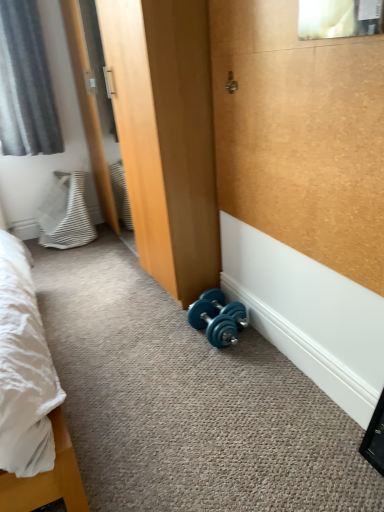
Measure the distance between point (12,78) and camera.

Point (12,78) and camera are 2.59 meters apart from each other.

Where is `white striped fabric pillow at left`? The width and height of the screenshot is (384, 512). white striped fabric pillow at left is located at coordinates pos(64,212).

The image size is (384, 512). Describe the element at coordinates (218, 318) in the screenshot. I see `teal rubber dumbbell at lower center` at that location.

Where is `clear glass mirror at upper center`? The image size is (384, 512). clear glass mirror at upper center is located at coordinates (338, 18).

Can you tell me how much white striped fabric pillow at left and clear glass mirror at upper center differ in facing direction?

95.2 degrees separate the facing orientations of white striped fabric pillow at left and clear glass mirror at upper center.

From a real-world perspective, which is physically above, white striped fabric pillow at left or clear glass mirror at upper center?

clear glass mirror at upper center.

Is white striped fabric pillow at left bigger than clear glass mirror at upper center?

Yes.

In terms of height, does white striped fabric pillow at left look taller or shorter compared to clear glass mirror at upper center?

Considering their sizes, white striped fabric pillow at left has more height than clear glass mirror at upper center.

Between teal rubber dumbbell at lower center and clear glass mirror at upper center, which one appears on the left side from the viewer's perspective?

teal rubber dumbbell at lower center.

In terms of size, does teal rubber dumbbell at lower center appear bigger or smaller than clear glass mirror at upper center?

Considering their sizes, teal rubber dumbbell at lower center takes up more space than clear glass mirror at upper center.

Is teal rubber dumbbell at lower center thinner than clear glass mirror at upper center?

Incorrect, the width of teal rubber dumbbell at lower center is not less than that of clear glass mirror at upper center.

From the image's perspective, which one is positioned higher, teal rubber dumbbell at lower center or clear glass mirror at upper center?

clear glass mirror at upper center, from the image's perspective.

Is gray fabric curtain at upper left oriented away from clear glass mirror at upper center?

No.

Identify the location of curtain that is under the clear glass mirror at upper center (from a real-world perspective). Image resolution: width=384 pixels, height=512 pixels. (25, 84).

Considering the relative positions of gray fabric curtain at upper left and clear glass mirror at upper center in the image provided, is gray fabric curtain at upper left to the left or to the right of clear glass mirror at upper center?

gray fabric curtain at upper left is to the left of clear glass mirror at upper center.

Based on their positions, is teal rubber dumbbell at lower center located to the left or right of white striped fabric pillow at left?

teal rubber dumbbell at lower center is to the right of white striped fabric pillow at left.

Are teal rubber dumbbell at lower center and white striped fabric pillow at left far apart?

Yes, teal rubber dumbbell at lower center and white striped fabric pillow at left are located far from each other.

Can you tell me how much teal rubber dumbbell at lower center and white striped fabric pillow at left differ in facing direction?

The angular difference between teal rubber dumbbell at lower center and white striped fabric pillow at left is 89.2 degrees.

Is white striped fabric pillow at left inside teal rubber dumbbell at lower center?

No.

Which is more distant, (81, 232) or (217, 298)?

The point (81, 232) is farther.

Is white striped fabric pillow at left aimed at teal rubber dumbbell at lower center?

Yes, white striped fabric pillow at left is oriented towards teal rubber dumbbell at lower center.

Consider the image. Would you say teal rubber dumbbell at lower center is part of white striped fabric pillow at left's contents?

No, teal rubber dumbbell at lower center is not surrounded by white striped fabric pillow at left.

Image resolution: width=384 pixels, height=512 pixels. In order to click on pillow behind the teal rubber dumbbell at lower center in this screenshot , I will do `click(64, 212)`.

Based on the photo, from the image's perspective, between gray fabric curtain at upper left and white striped fabric pillow at left, which one is located above?

From the image's view, gray fabric curtain at upper left is above.

Can you tell me how much gray fabric curtain at upper left and white striped fabric pillow at left differ in facing direction?

4.37 degrees.

From a real-world perspective, is gray fabric curtain at upper left above or below white striped fabric pillow at left?

In terms of real-world spatial position, gray fabric curtain at upper left is above white striped fabric pillow at left.

Can you confirm if gray fabric curtain at upper left is positioned to the right of white striped fabric pillow at left?

In fact, gray fabric curtain at upper left is to the left of white striped fabric pillow at left.

Is clear glass mirror at upper center to the left of white striped fabric pillow at left from the viewer's perspective?

Incorrect, clear glass mirror at upper center is not on the left side of white striped fabric pillow at left.

Is point (372, 13) positioned before point (51, 203)?

That is True.

Who is taller, clear glass mirror at upper center or white striped fabric pillow at left?

white striped fabric pillow at left is taller.

Find the location of a particular element. window screen above the white striped fabric pillow at left (from the image's perspective) is located at coordinates (338, 18).

Find the location of a particular element. The width and height of the screenshot is (384, 512). pillow that appears on the left of clear glass mirror at upper center is located at coordinates (64, 212).

The height and width of the screenshot is (512, 384). I want to click on dumbbell beneath the clear glass mirror at upper center (from a real-world perspective), so click(x=218, y=318).

Which object lies further to the anchor point white striped fabric pillow at left, clear glass mirror at upper center or gray fabric curtain at upper left?

clear glass mirror at upper center is positioned further to the anchor white striped fabric pillow at left.

Estimate the real-world distances between objects in this image. Which object is closer to gray fabric curtain at upper left, teal rubber dumbbell at lower center or clear glass mirror at upper center?

Based on the image, teal rubber dumbbell at lower center appears to be nearer to gray fabric curtain at upper left.

From the image, which object appears to be nearer to white striped fabric pillow at left, teal rubber dumbbell at lower center or gray fabric curtain at upper left?

gray fabric curtain at upper left lies closer to white striped fabric pillow at left than the other object.

Based on the photo, looking at the image, which one is located further to white striped fabric pillow at left, gray fabric curtain at upper left or teal rubber dumbbell at lower center?

teal rubber dumbbell at lower center lies further to white striped fabric pillow at left than the other object.

From the image, which object appears to be nearer to gray fabric curtain at upper left, teal rubber dumbbell at lower center or white striped fabric pillow at left?

Based on the image, white striped fabric pillow at left appears to be nearer to gray fabric curtain at upper left.

From the image, which object appears to be farther from teal rubber dumbbell at lower center, gray fabric curtain at upper left or white striped fabric pillow at left?

Among the two, gray fabric curtain at upper left is located further to teal rubber dumbbell at lower center.

From the image, which object appears to be farther from clear glass mirror at upper center, white striped fabric pillow at left or teal rubber dumbbell at lower center?

Among the two, white striped fabric pillow at left is located further to clear glass mirror at upper center.

Which object lies further to the anchor point clear glass mirror at upper center, teal rubber dumbbell at lower center or white striped fabric pillow at left?

white striped fabric pillow at left is positioned further to the anchor clear glass mirror at upper center.

Where is `dumbbell between clear glass mirror at upper center and white striped fabric pillow at left from front to back`? The image size is (384, 512). dumbbell between clear glass mirror at upper center and white striped fabric pillow at left from front to back is located at coordinates (218, 318).

You are a GUI agent. You are given a task and a screenshot of the screen. Output one action in this format:
    pyautogui.click(x=<x>, y=<y>)
    Task: Click on the curtain between clear glass mirror at upper center and white striped fabric pillow at left in the front-back direction
    The image size is (384, 512).
    Given the screenshot: What is the action you would take?
    pyautogui.click(x=25, y=84)

The height and width of the screenshot is (512, 384). I want to click on dumbbell between clear glass mirror at upper center and gray fabric curtain at upper left along the z-axis, so click(218, 318).

At what (x,y) coordinates should I click in order to perform the action: click on pillow that lies between gray fabric curtain at upper left and teal rubber dumbbell at lower center from top to bottom. Please return your answer as a coordinate pair (x, y). The width and height of the screenshot is (384, 512). Looking at the image, I should click on (64, 212).